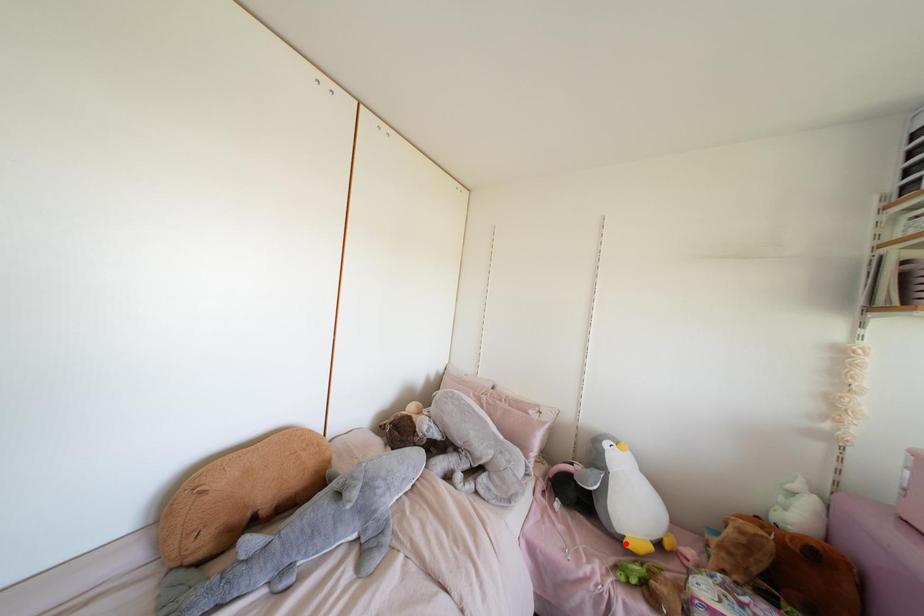
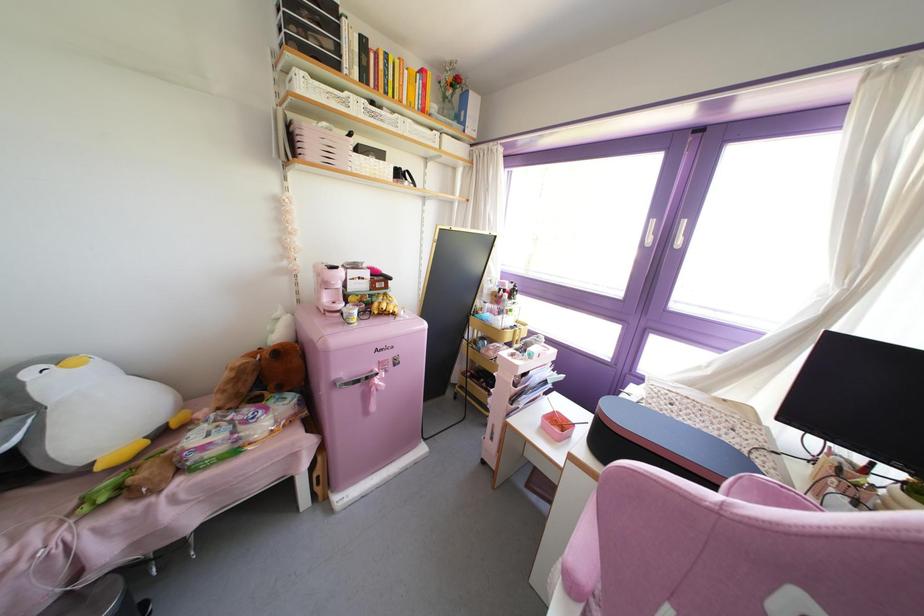
Question: I am providing you with two images of the same scene from different viewpoints. In image1, a red point is highlighted. Considering the same 3D point in image2, which of the following is correct?

Choices:
 (A) It is closer
 (B) It is farther

Answer: (A)